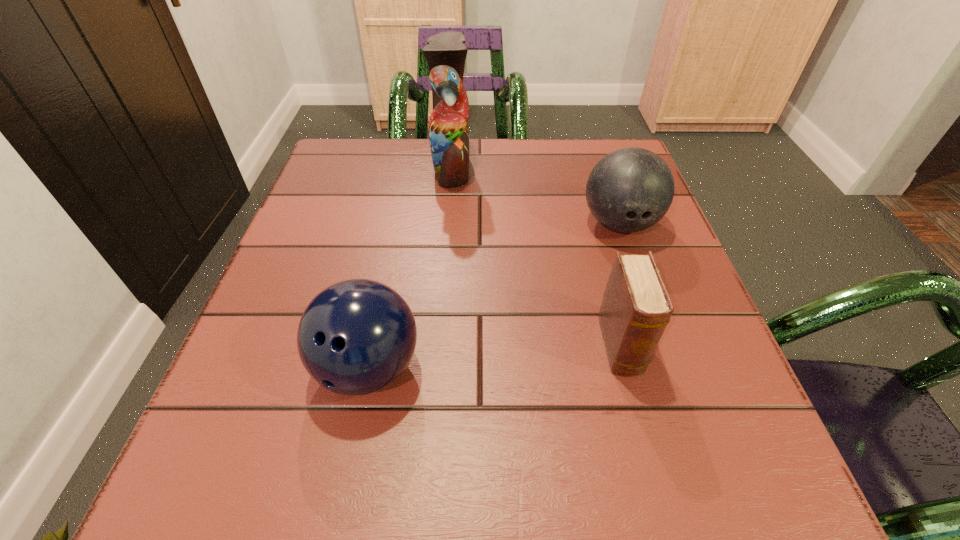
This screenshot has width=960, height=540. I want to click on vacant point located between the right bowling ball and the nearer bowling ball, so click(x=494, y=296).

Find the location of `vacant region between the farthest object and the farther bowling ball`. vacant region between the farthest object and the farther bowling ball is located at coordinates (536, 194).

Identify the location of vacant region between the nearer bowling ball and the farther bowling ball. (494, 296).

What are the coordinates of `vacant area that lies between the right bowling ball and the tallest object` in the screenshot? It's located at click(x=536, y=194).

This screenshot has width=960, height=540. I want to click on free space between the right bowling ball and the tallest object, so click(536, 194).

Find the location of a particular element. vacant region between the third nearest object and the left bowling ball is located at coordinates (494, 296).

Point out which object is positioned as the second nearest to the left bowling ball. Please provide its 2D coordinates. Your answer should be formatted as a tuple, i.e. [(x, y)], where the tuple contains the x and y coordinates of a point satisfying the conditions above.

[(630, 189)]

Locate an element on the screen. the third closest object relative to the right bowling ball is located at coordinates (356, 337).

Find the location of a particular element. This screenshot has width=960, height=540. vacant space that satisfies the following two spatial constraints: 1. at the face of the parrot; 2. on the surface of the left bowling ball near the finger holes is located at coordinates (435, 368).